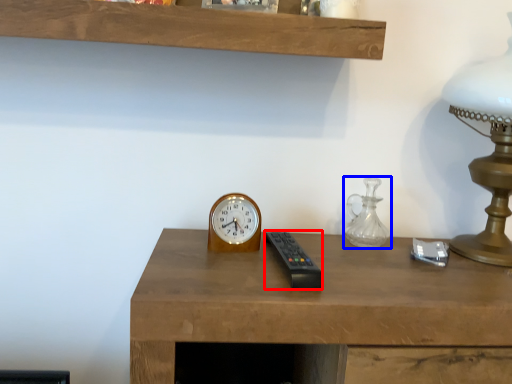
Question: Which of the following is the farthest to the observer, control (highlighted by a red box) or glass vase (highlighted by a blue box)?

Choices:
 (A) control
 (B) glass vase

Answer: (B)